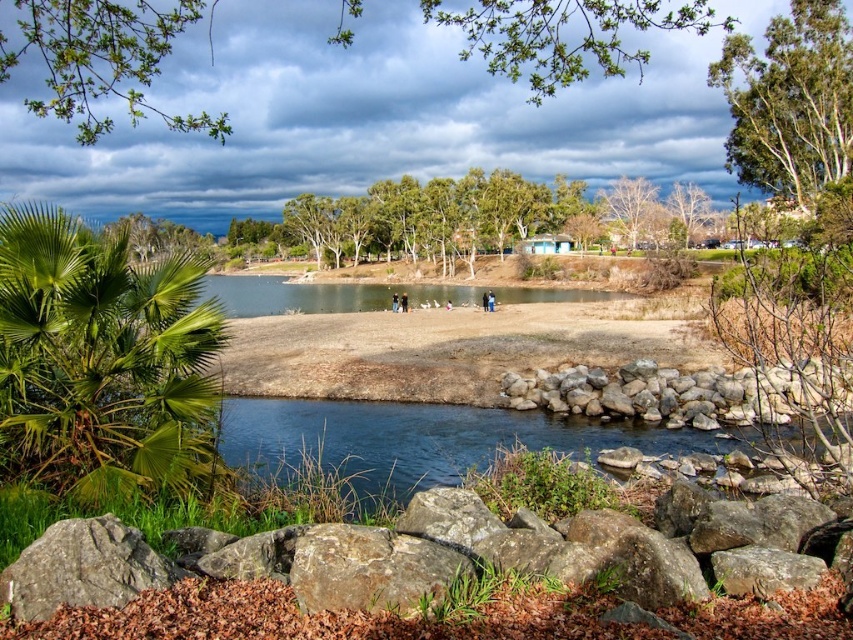
From the picture: Does green leafy tree at upper right appear over gray rock wall at lower center?

Indeed, green leafy tree at upper right is positioned over gray rock wall at lower center.

Does green leafy tree at upper right have a greater width compared to gray rock wall at lower center?

Yes.

Which is in front, point (813, 26) or point (772, 388)?

Positioned in front is point (772, 388).

Identify the location of green leafy tree at upper right. (790, 100).

Consider the image. Is green leafy palm at lower left below bare branches at upper center?

Correct, green leafy palm at lower left is located below bare branches at upper center.

Does green leafy palm at lower left appear on the right side of bare branches at upper center?

No, green leafy palm at lower left is not to the right of bare branches at upper center.

Who is more forward, (141, 422) or (624, 228)?

Positioned in front is point (141, 422).

Where is `green leafy palm at lower left`? Image resolution: width=853 pixels, height=640 pixels. green leafy palm at lower left is located at coordinates (102, 362).

Based on the photo, does green leafy palm at lower left come in front of gray rock wall at lower center?

That is True.

What do you see at coordinates (102, 362) in the screenshot?
I see `green leafy palm at lower left` at bounding box center [102, 362].

The height and width of the screenshot is (640, 853). I want to click on green leafy palm at lower left, so click(102, 362).